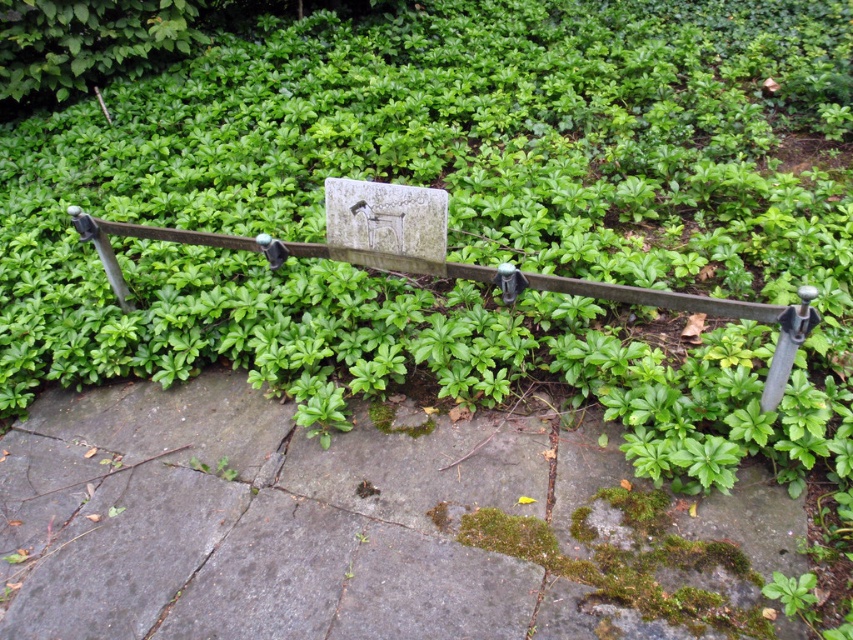
You are standing in front of the stone plaque and notice two points marked on it. The first point is at coordinates point (125, 456) and the second at point (763, 314). If you were to touch both points with your finger, which one would feel closer to your hand?

Point (125, 456) is further to the viewer than point (763, 314), so when touching both points, the point (125, 456) would feel closer to your hand since it is nearer to you.

You are standing in front of the stone plaque mounted on a metal frame. You notice a point marked at coordinates (351, 525). What does this point indicate?

The point at coordinates (351, 525) marks the mossy stone pavement at center.

Looking at this image, you are a gardener who needs to water the green leafy bush at upper left using a watering can that can spray up to 2 meters. You are currently standing at the green metal fence at center. Can you reach the bush without moving closer?

The distance between the green metal fence at center and the green leafy bush at upper left is 2.61 meters. Since the watering can can only spray up to 2 meters, you cannot reach the bush without moving closer.